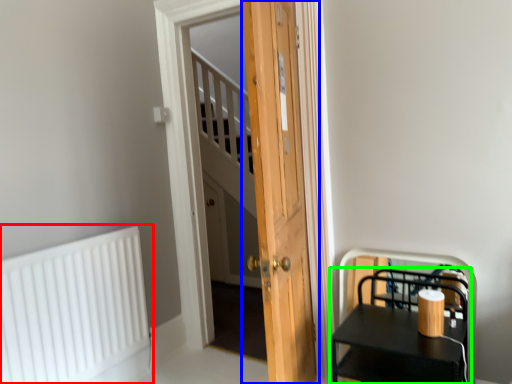
Question: Estimate the real-world distances between objects in this image. Which object is closer to radiator (highlighted by a red box), door (highlighted by a blue box) or furniture (highlighted by a green box)?

Choices:
 (A) door
 (B) furniture

Answer: (A)